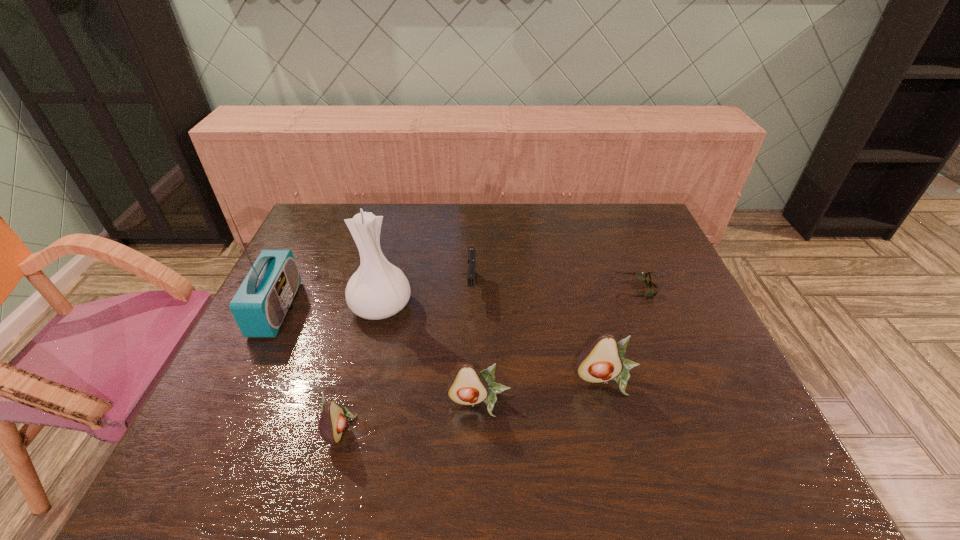
Please point a free position for a avocado on the right. Please provide its 2D coordinates. Your answer should be formatted as a tuple, i.e. [(x, y)], where the tuple contains the x and y coordinates of a point satisfying the conditions above.

[(724, 360)]